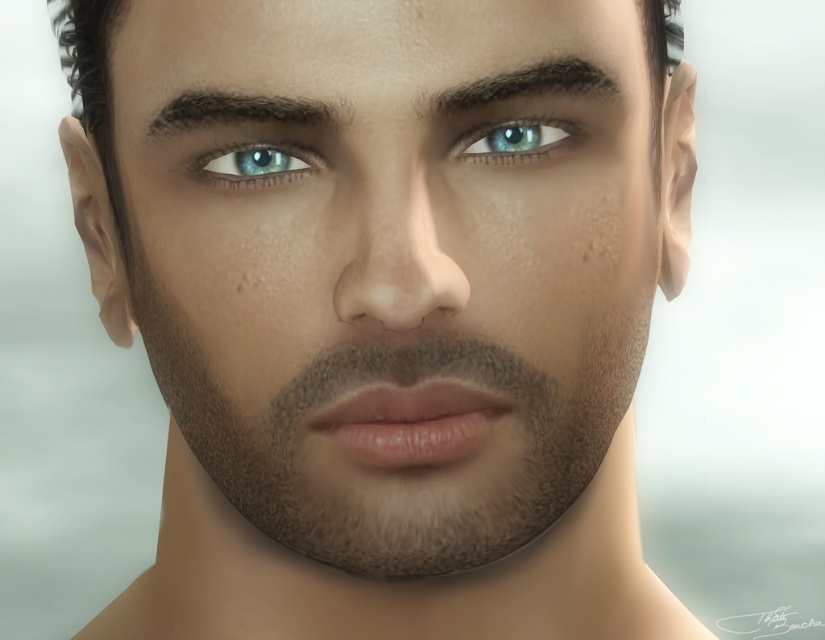
You are a makeup artist preparing for a photoshoot. You need to apply eyeliner to the dark brown textured eyebrow at upper center and dark brown hair at upper center. However, the eyeliner pencil you have is only 2 inches long. Can you use this pencil to cover both areas without needing to sharpen it again?

The dark brown textured eyebrow at upper center and dark brown hair at upper center are 2.67 inches apart from each other. Since the eyeliner pencil is only 2 inches long, it is not long enough to cover the distance between them without needing to be sharpened again.